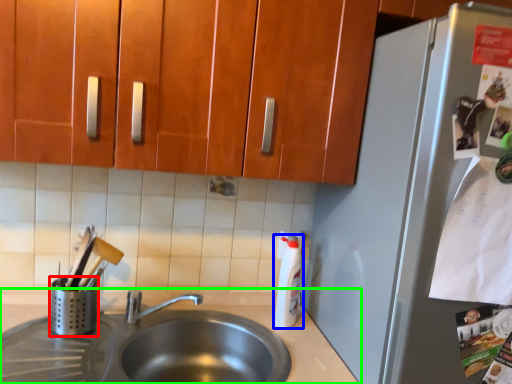
Question: Considering the real-world distances, which object is closest to appliance (highlighted by a red box)? bottle (highlighted by a blue box) or countertop (highlighted by a green box).

Choices:
 (A) bottle
 (B) countertop

Answer: (B)